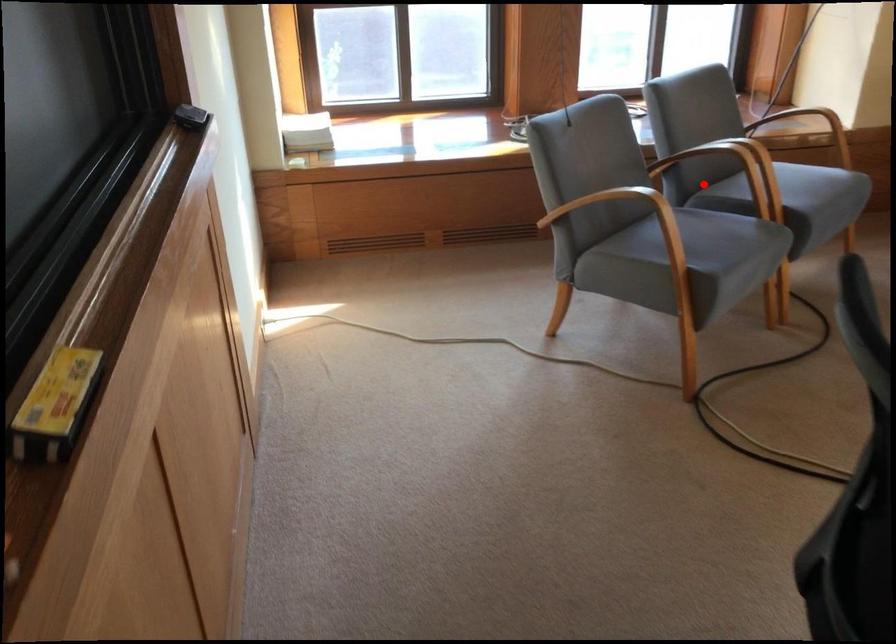
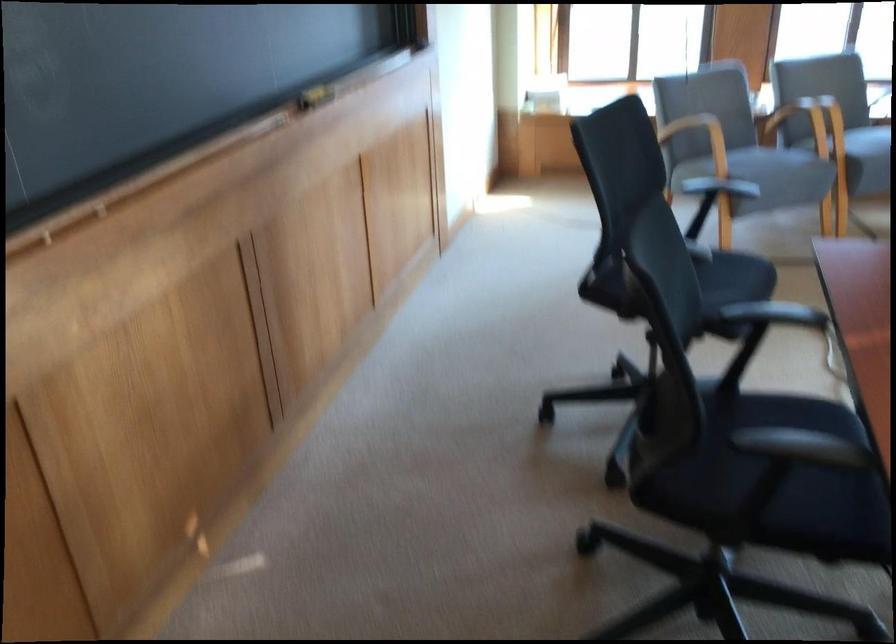
Question: I am providing you with two images of the same scene from different viewpoints. In image1, a red point is highlighted. Considering the same 3D point in image2, which of the following is correct?

Choices:
 (A) It is closer
 (B) It is farther

Answer: (B)